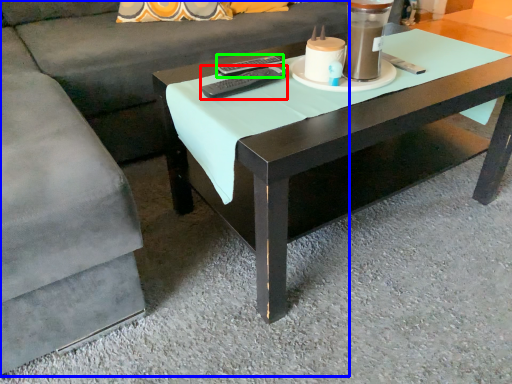
Question: Which object is positioned closest to remote (highlighted by a red box)? Select from couch (highlighted by a blue box) and remote (highlighted by a green box).

Choices:
 (A) couch
 (B) remote

Answer: (B)